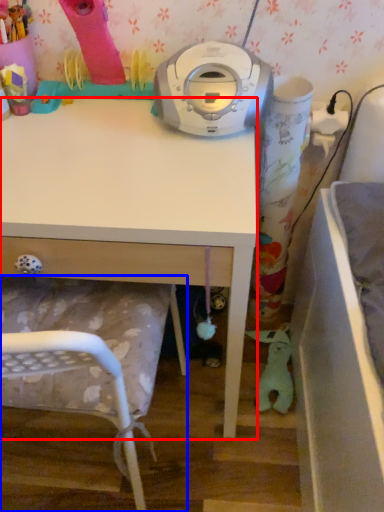
Question: Which of the following is the closest to the observer, desk (highlighted by a red box) or chair (highlighted by a blue box)?

Choices:
 (A) desk
 (B) chair

Answer: (B)